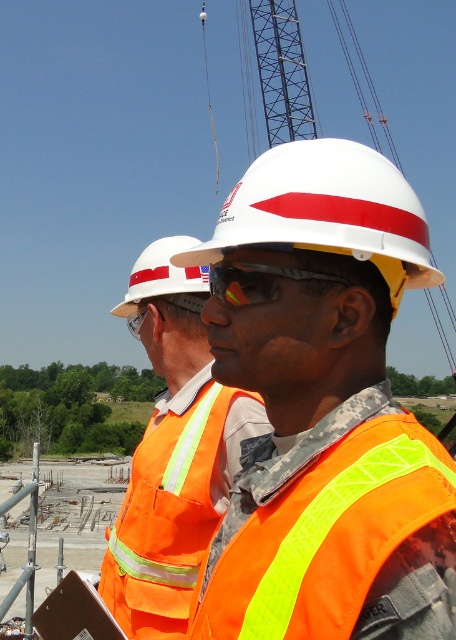
Question: Which point is farther from the camera taking this photo?

Choices:
 (A) (243, 301)
 (B) (309, 438)

Answer: (A)

Question: Is neon yellow reflective safety vest at center below orange reflective safety vest at center?

Choices:
 (A) yes
 (B) no

Answer: (B)

Question: Is white hard hat at center thinner than orange reflective safety vest at center?

Choices:
 (A) no
 (B) yes

Answer: (A)

Question: Among these objects, which one is nearest to the camera?

Choices:
 (A) white hard hat at center
 (B) neon yellow reflective safety vest at center

Answer: (B)

Question: Considering the real-world distances, which object is closest to the clear plastic goggles at center?

Choices:
 (A) white hard hat at center
 (B) orange reflective vest at center
 (C) orange reflective safety vest at center

Answer: (B)

Question: Is orange reflective vest at center bigger than neon yellow reflective safety vest at center?

Choices:
 (A) yes
 (B) no

Answer: (A)